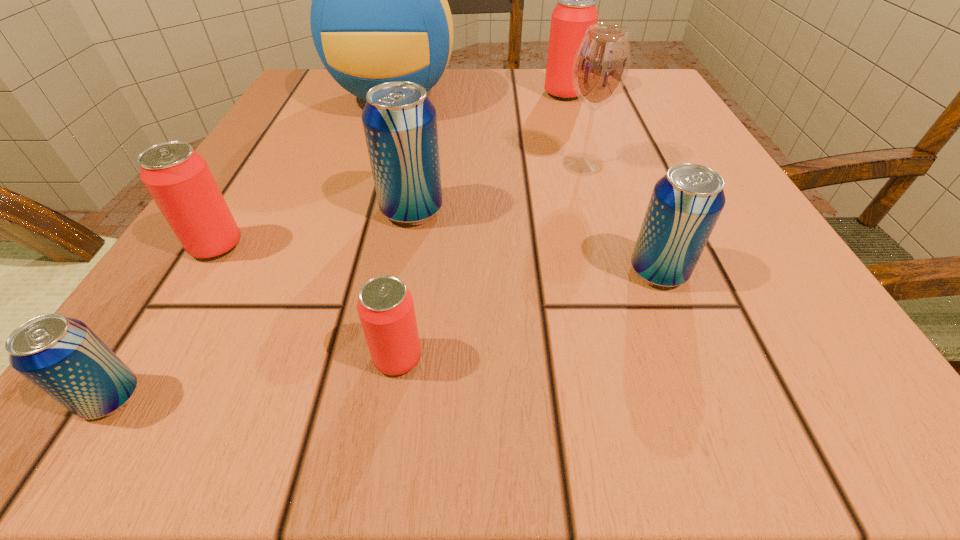
Point out which red beer can is positioned as the third nearest to the wineglass. Please provide its 2D coordinates. Your answer should be formatted as a tuple, i.e. [(x, y)], where the tuple contains the x and y coordinates of a point satisfying the conditions above.

[(178, 179)]

Identify which blue beer can is the closest to the biggest red beer can. Please provide its 2D coordinates. Your answer should be formatted as a tuple, i.e. [(x, y)], where the tuple contains the x and y coordinates of a point satisfying the conditions above.

[(400, 123)]

Find the location of a particular element. Image resolution: width=960 pixels, height=540 pixels. blue beer can that stands as the second closest to the red wineglass is located at coordinates (400, 123).

Find the location of a particular element. Image resolution: width=960 pixels, height=540 pixels. vacant point that satisfies the following two spatial constraints: 1. on the front side of the nearest red beer can; 2. on the right side of the tallest object is located at coordinates (314, 358).

Locate an element on the screen. free location that satisfies the following two spatial constraints: 1. on the back side of the seventh shortest object; 2. on the left side of the farthest red beer can is located at coordinates (562, 94).

This screenshot has height=540, width=960. I want to click on free space that satisfies the following two spatial constraints: 1. on the front side of the farthest blue beer can; 2. on the left side of the volleyball, so click(x=359, y=210).